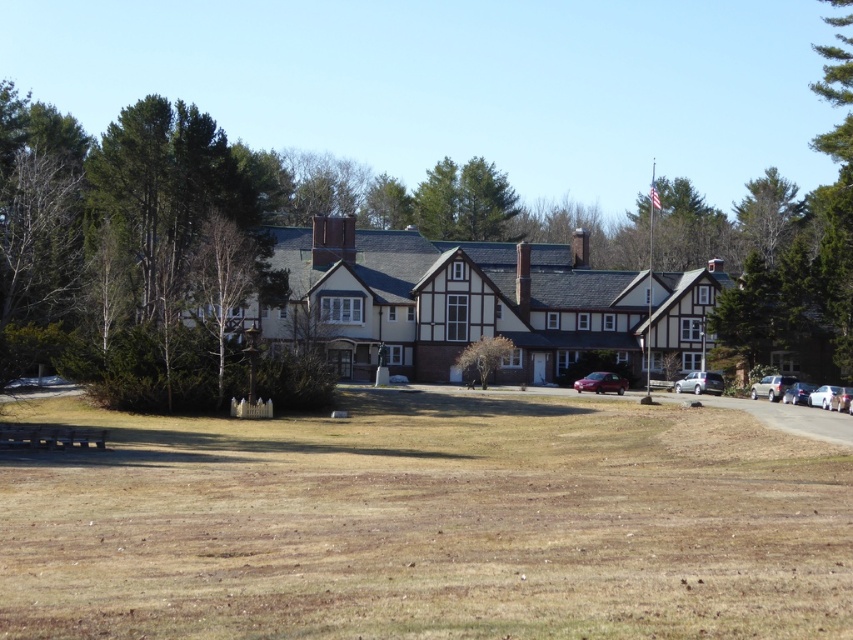
You are a delivery driver who needs to park your delivery van between the metallic red car at center and the white glossy car at right. Considering the height differences between the two cars, which car should you park closer to in order to ensure your van, which has a height of 2 meters, doesn

The metallic red car at center is much taller than the white glossy car at right. Therefore, you should park closer to the white glossy car at right since it is shorter, allowing more vertical clearance for your van.

You are standing at the entrance of the Tudor building and want to park your metallic red car at center. The parking spot you want is at coordinate point 0.6, 0.7. Is your car already in the correct parking spot?

The metallic red car at center is located at point (601, 381), which is very close to the desired parking spot at (596, 384). Considering minor rounding differences, the car is effectively in the correct parking spot.

You are a delivery driver approaching the building and need to park your vehicle. You see a satin silver suv at right and a satin silver sedan at right. Which vehicle should you move around to access the entrance without obstructing the other vehicle?

You should move around the satin silver suv at right because it is closer to you, and the satin silver sedan at right is behind it. By moving around the closer vehicle, you can access the entrance without blocking the sedan behind.